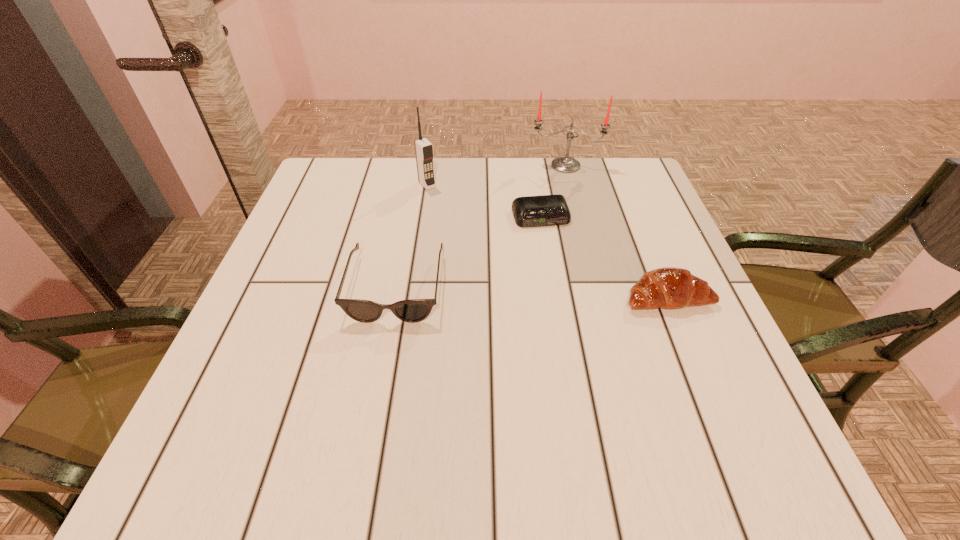
Find the location of a particular element. vacant point located 0.280m on the front-facing side of the fourth nearest object is located at coordinates (489, 250).

Find the location of a particular element. Image resolution: width=960 pixels, height=540 pixels. vacant space located on the front-facing side of the farthest object is located at coordinates (564, 200).

Find the location of a particular element. The width and height of the screenshot is (960, 540). vacant area situated on the front-facing side of the farthest object is located at coordinates (564, 196).

This screenshot has width=960, height=540. I want to click on free region located 0.070m on the front-facing side of the farthest object, so click(564, 187).

This screenshot has height=540, width=960. What are the coordinates of `free space located on the display of the alarm clock` in the screenshot? It's located at (577, 316).

This screenshot has width=960, height=540. I want to click on vacant space located on the display of the alarm clock, so click(558, 263).

The height and width of the screenshot is (540, 960). I want to click on vacant space located on the display of the alarm clock, so click(x=551, y=242).

Image resolution: width=960 pixels, height=540 pixels. In order to click on cellular telephone that is positioned at the far edge in this screenshot , I will do `click(424, 153)`.

This screenshot has height=540, width=960. Find the location of `candle that is at the far edge`. candle that is at the far edge is located at coordinates (565, 164).

Find the location of a particular element. This screenshot has height=540, width=960. alarm clock that is at the far edge is located at coordinates (532, 211).